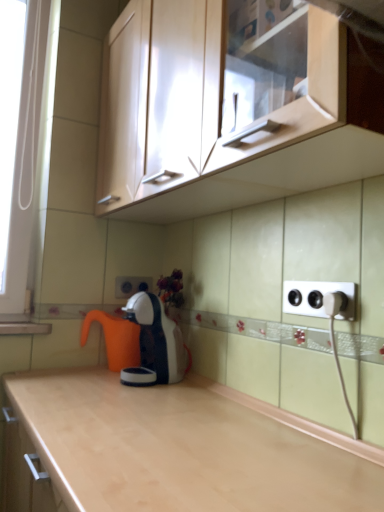
Question: Considering their positions, is white plastic plug at right located in front of or behind matte wood cabinet at upper center?

Choices:
 (A) front
 (B) behind

Answer: (B)

Question: In terms of height, does white plastic plug at right look taller or shorter compared to matte wood cabinet at upper center?

Choices:
 (A) tall
 (B) short

Answer: (B)

Question: Which object is positioned farthest from the matte wood cabinet at upper center?

Choices:
 (A) orange plastic coffee pot at center
 (B) white glossy coffee machine at center
 (C) white plastic electric outlet at center, the 1th electric outlet when ordered from back to front
 (D) white plastic electrical outlet at right, placed as the first electric outlet when sorted from right to left
 (E) white plastic plug at right

Answer: (C)

Question: Based on their relative distances, which object is farther from the orange plastic coffee pot at center?

Choices:
 (A) white plastic plug at right
 (B) white glossy coffee machine at center
 (C) white plastic electric outlet at center, which appears as the second electric outlet when viewed from the front
 (D) matte wood cabinet at upper center
 (E) white plastic electrical outlet at right, arranged as the 2th electric outlet when viewed from the back

Answer: (A)